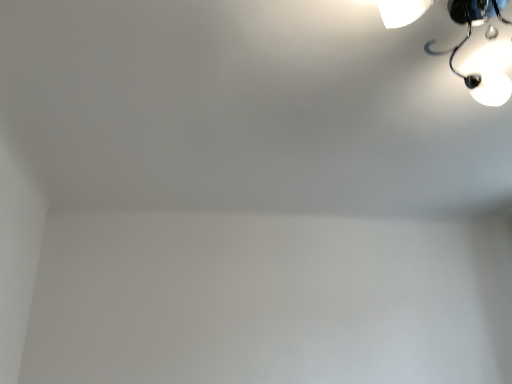
Where is `white glossy lamp at upper right`? This screenshot has height=384, width=512. white glossy lamp at upper right is located at coordinates (467, 39).

Measure the distance between white glossy lamp at upper right and camera.

white glossy lamp at upper right and camera are 3.72 feet apart.

The image size is (512, 384). What do you see at coordinates (467, 39) in the screenshot?
I see `white glossy lamp at upper right` at bounding box center [467, 39].

Locate an element on the screen. This screenshot has height=384, width=512. white glossy lamp at upper right is located at coordinates (467, 39).